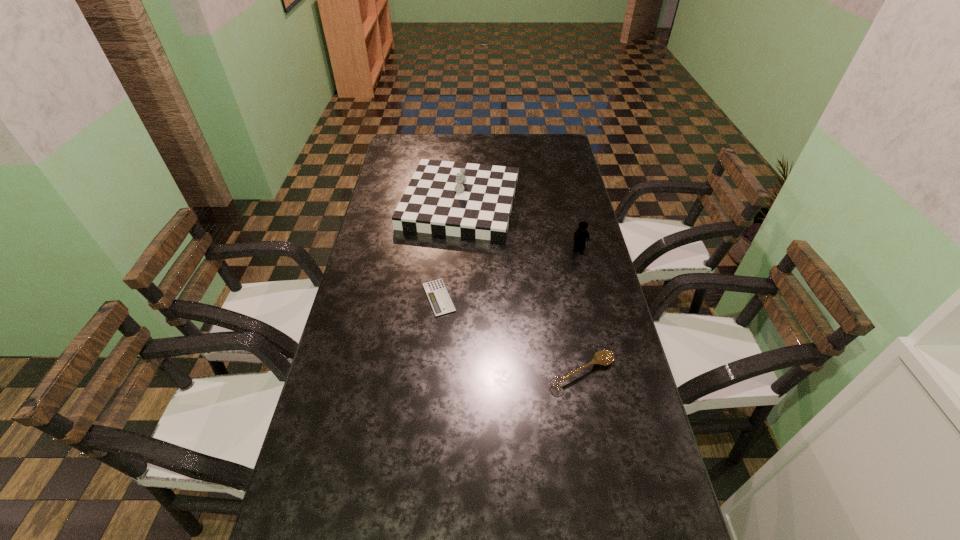
Locate an element on the screen. This screenshot has width=960, height=540. checkerboard is located at coordinates (468, 200).

The height and width of the screenshot is (540, 960). In order to click on the tallest object in this screenshot , I will do `click(468, 200)`.

The height and width of the screenshot is (540, 960). In order to click on Lego in this screenshot , I will do `click(580, 236)`.

The image size is (960, 540). In order to click on the second farthest object in this screenshot , I will do `click(580, 236)`.

This screenshot has height=540, width=960. Identify the location of the nearest object. (603, 357).

Locate an element on the screen. This screenshot has height=540, width=960. ladle is located at coordinates (603, 357).

This screenshot has width=960, height=540. Find the location of `the second nearest object`. the second nearest object is located at coordinates (437, 294).

The image size is (960, 540). Identify the location of the shortest object. (437, 294).

The width and height of the screenshot is (960, 540). What are the coordinates of `free region located 0.300m on the back of the checkerboard` in the screenshot? It's located at (464, 136).

This screenshot has height=540, width=960. Find the location of `free point located 0.140m on the front-facing side of the Lego`. free point located 0.140m on the front-facing side of the Lego is located at coordinates (588, 280).